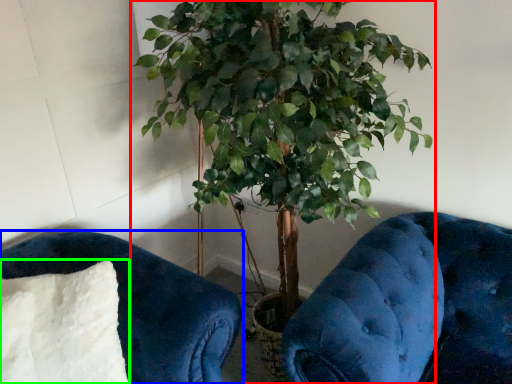
Question: Which object is the farthest from houseplant (highlighted by a red box)? Choose among these: furniture (highlighted by a blue box) or pillow (highlighted by a green box).

Choices:
 (A) furniture
 (B) pillow

Answer: (B)